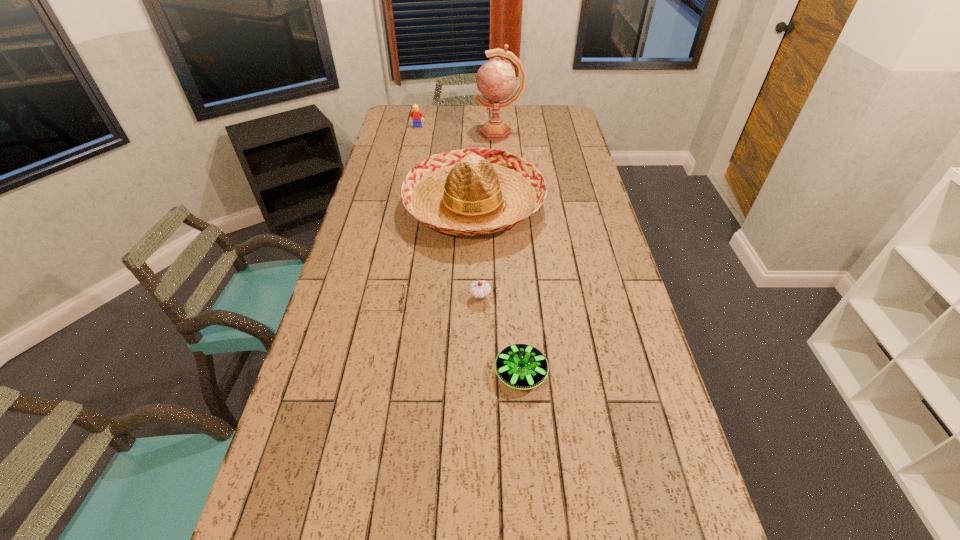
Locate an element on the screen. This screenshot has width=960, height=540. empty location between the Lego and the tallest object is located at coordinates (458, 130).

Identify the location of empty space between the nearest object and the shortest object. (452, 338).

Identify which object is the fourth nearest to the Lego. Please provide its 2D coordinates. Your answer should be formatted as a tuple, i.e. [(x, y)], where the tuple contains the x and y coordinates of a point satisfying the conditions above.

[(479, 289)]

Choose which object is the second nearest neighbor to the shortest object. Please provide its 2D coordinates. Your answer should be formatted as a tuple, i.e. [(x, y)], where the tuple contains the x and y coordinates of a point satisfying the conditions above.

[(479, 289)]

At what (x,y) coordinates should I click in order to perform the action: click on vacant space that satisfies the following two spatial constraints: 1. on the face of the nearest object; 2. on the right side of the Lego. Please return your answer as a coordinate pair (x, y). Looking at the image, I should click on (365, 373).

Identify the location of vacant area that satisfies the following two spatial constraints: 1. on the face of the Lego; 2. on the left side of the nearest object. (365, 373).

This screenshot has width=960, height=540. In order to click on free spot that satisfies the following two spatial constraints: 1. on the front-facing side of the shortest object; 2. on the back side of the nearest object in this screenshot , I will do `click(370, 373)`.

Where is `blank space that satisfies the following two spatial constraints: 1. on the face of the Lego; 2. on the right side of the cupcake`? The height and width of the screenshot is (540, 960). blank space that satisfies the following two spatial constraints: 1. on the face of the Lego; 2. on the right side of the cupcake is located at coordinates (381, 297).

At what (x,y) coordinates should I click in order to perform the action: click on free location that satisfies the following two spatial constraints: 1. on the front side of the cupcake; 2. on the front-facing side of the sunglasses. Please return your answer as a coordinate pair (x, y). Looking at the image, I should click on (480, 303).

You are a GUI agent. You are given a task and a screenshot of the screen. Output one action in this format:
    pyautogui.click(x=<x>, y=<y>)
    Task: Click on the free region that satisfies the following two spatial constraints: 1. on the face of the nearest object; 2. on the left side of the Lego
    
    Given the screenshot: What is the action you would take?
    pyautogui.click(x=365, y=373)